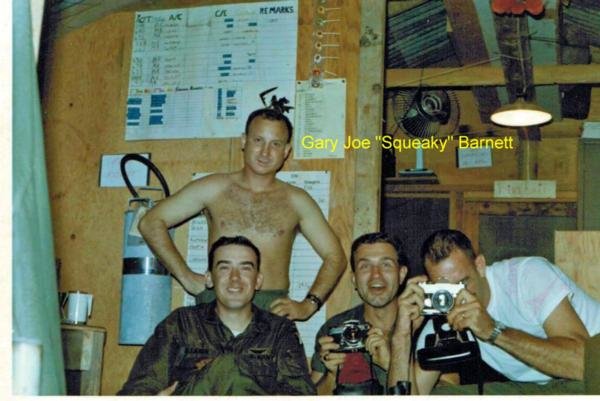
You are a GUI agent. You are given a task and a screenshot of the screen. Output one action in this format:
    pyautogui.click(x=<x>, y=<y>)
    Task: Click on the fan
    The height and width of the screenshot is (401, 600).
    Given the screenshot: What is the action you would take?
    pyautogui.click(x=433, y=102)